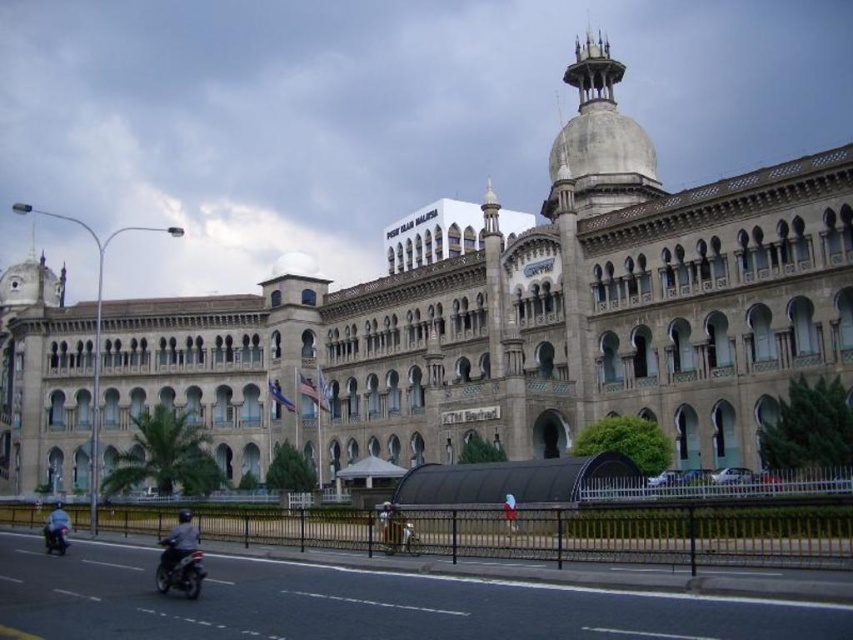
Does black matte motorbike at lower left appear under gray matte jacket on the left?

No.

Image resolution: width=853 pixels, height=640 pixels. Describe the element at coordinates (178, 570) in the screenshot. I see `black matte motorbike at lower left` at that location.

Locate an element on the screen. This screenshot has height=640, width=853. black matte motorbike at lower left is located at coordinates (178, 570).

Can you confirm if gray matte jacket on the left is smaller than blue fabric helmet at lower left?

No, gray matte jacket on the left is not smaller than blue fabric helmet at lower left.

Which is more to the right, gray matte jacket on the left or blue fabric helmet at lower left?

gray matte jacket on the left

Is point (169, 556) farther from viewer compared to point (62, 541)?

No, (169, 556) is closer to viewer.

Identify the location of gray matte jacket on the left. (178, 540).

Which of these two, black matte motorbike at lower left or blue fabric helmet at lower left, stands shorter?

black matte motorbike at lower left

Is black matte motorbike at lower left below blue fabric helmet at lower left?

No, black matte motorbike at lower left is not below blue fabric helmet at lower left.

The height and width of the screenshot is (640, 853). Find the location of `black matte motorbike at lower left`. black matte motorbike at lower left is located at coordinates (178, 570).

Identify the location of black matte motorbike at lower left. The width and height of the screenshot is (853, 640). (178, 570).